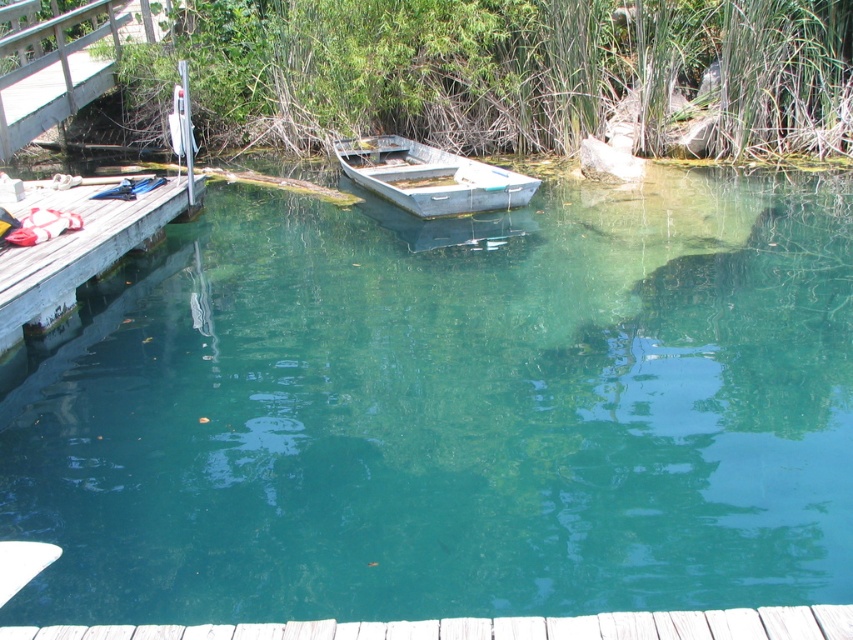
Question: Among these points, which one is nearest to the camera?

Choices:
 (A) (709, 506)
 (B) (57, 317)
 (C) (392, 140)

Answer: (A)

Question: Estimate the real-world distances between objects in this image. Which object is farther from the wooden dock at left?

Choices:
 (A) metallic gray boat at center
 (B) green translucent water at center

Answer: (A)

Question: Is green translucent water at center bigger than wooden dock at left?

Choices:
 (A) no
 (B) yes

Answer: (B)

Question: Among these points, which one is nearest to the camera?

Choices:
 (A) (364, 138)
 (B) (138, 588)
 (C) (48, 305)

Answer: (B)

Question: Considering the relative positions of green translucent water at center and wooden dock at left in the image provided, where is green translucent water at center located with respect to wooden dock at left?

Choices:
 (A) above
 (B) below

Answer: (B)

Question: Is wooden dock at left in front of metallic gray boat at center?

Choices:
 (A) yes
 (B) no

Answer: (A)